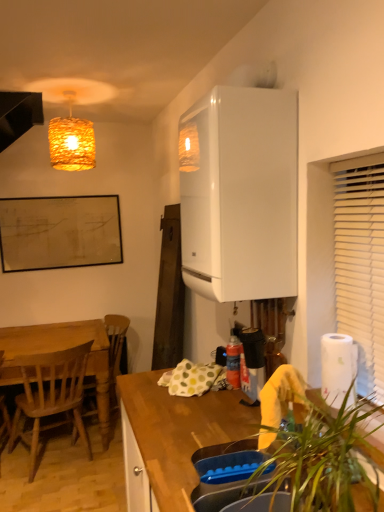
Locate an element on the screen. vacant region below white glossy boiler at upper right (from a real-world perspective) is located at coordinates (228, 405).